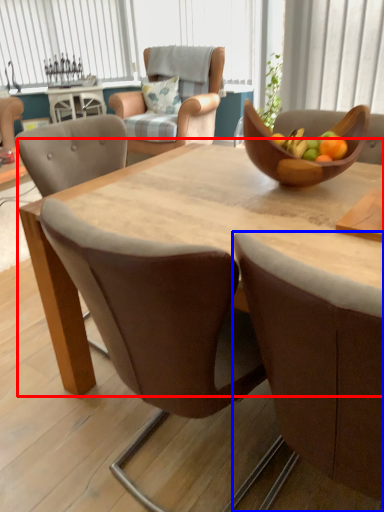
Question: Which of the following is the farthest to the observer, round table (highlighted by a red box) or chair (highlighted by a blue box)?

Choices:
 (A) round table
 (B) chair

Answer: (A)